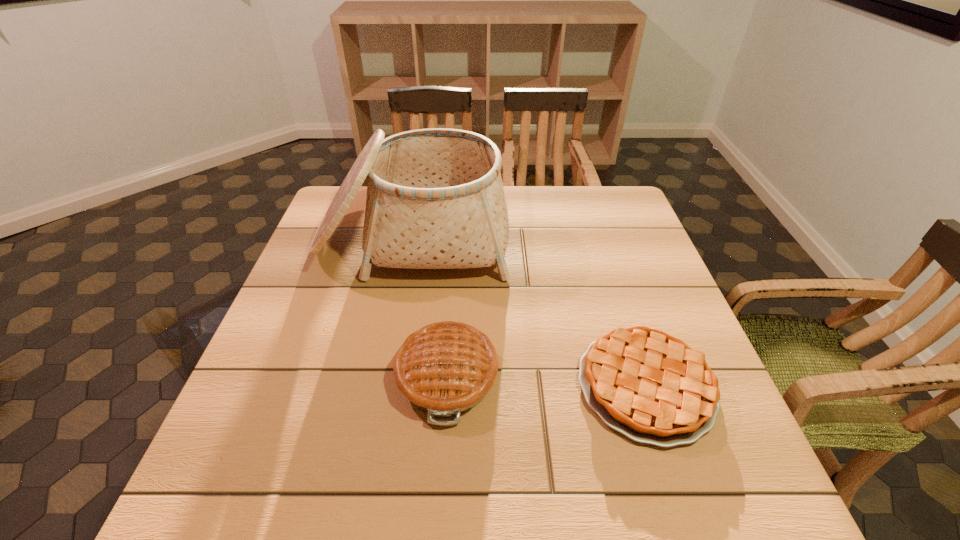
You are a GUI agent. You are given a task and a screenshot of the screen. Output one action in this format:
    pyautogui.click(x=<x>, y=<y>)
    Task: Click on the tallest object
    This screenshot has height=540, width=960.
    Given the screenshot: What is the action you would take?
    pyautogui.click(x=435, y=199)

Identify the location of the farthest object. This screenshot has width=960, height=540. (435, 199).

In order to click on the second shortest object in this screenshot , I will do `click(445, 368)`.

The height and width of the screenshot is (540, 960). In order to click on the left pie in this screenshot , I will do `click(445, 368)`.

Where is `the shortest object`? The height and width of the screenshot is (540, 960). the shortest object is located at coordinates (652, 387).

You are a GUI agent. You are given a task and a screenshot of the screen. Output one action in this format:
    pyautogui.click(x=<x>, y=<y>)
    Task: Click on the shorter pie
    
    Given the screenshot: What is the action you would take?
    pyautogui.click(x=652, y=387)

Where is `free spot located 0.370m with the lid open on the basket`? The image size is (960, 540). free spot located 0.370m with the lid open on the basket is located at coordinates (378, 417).

Where is `free location located 0.070m on the back of the second tallest object`? The width and height of the screenshot is (960, 540). free location located 0.070m on the back of the second tallest object is located at coordinates (452, 308).

Locate an element on the screen. Image resolution: width=960 pixels, height=540 pixels. vacant region located 0.200m on the left of the rightmost object is located at coordinates (477, 386).

You are a GUI agent. You are given a task and a screenshot of the screen. Output one action in this format:
    pyautogui.click(x=<x>, y=<y>)
    Task: Click on the object that is at the far edge
    The width and height of the screenshot is (960, 540).
    Given the screenshot: What is the action you would take?
    pyautogui.click(x=435, y=199)